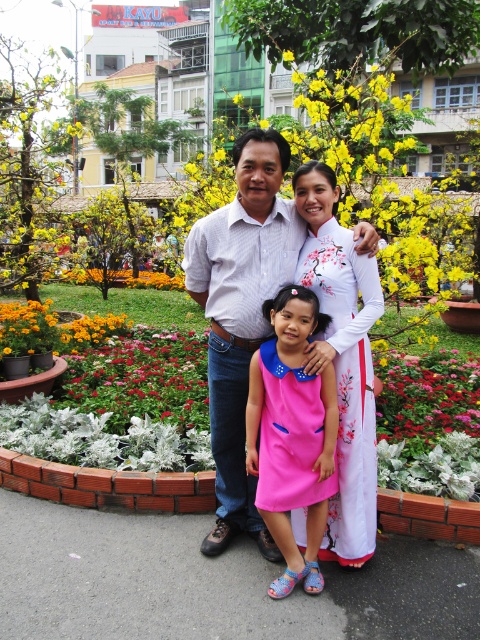
You are a photographer trying to capture a family portrait in the urban park. The family is wearing the white striped shirt at center and standing in front of the yellow fabric flower bed at center. If you want to ensure both the family and the flower bed are fully visible in the photo, which object should you focus on to frame the shot properly?

The white striped shirt at center has a smaller width than the yellow fabric flower bed at center. To frame the shot properly, focus on the yellow fabric flower bed at center since it is wider and will help ensure both the family and the flower bed are fully visible.

You are a photographer setting up a tripod in the urban park scene. You need to place the tripod between the white felt flower bed at lower left and the multicolored fabric at center. The tripod requires a minimum of 40 inches of space between these two objects to fit. Can you fit the tripod in this space?

The white felt flower bed at lower left is 37.01 inches from the multicolored fabric at center. Since the required space for the tripod is 40 inches, the distance is insufficient. The tripod cannot be placed here.